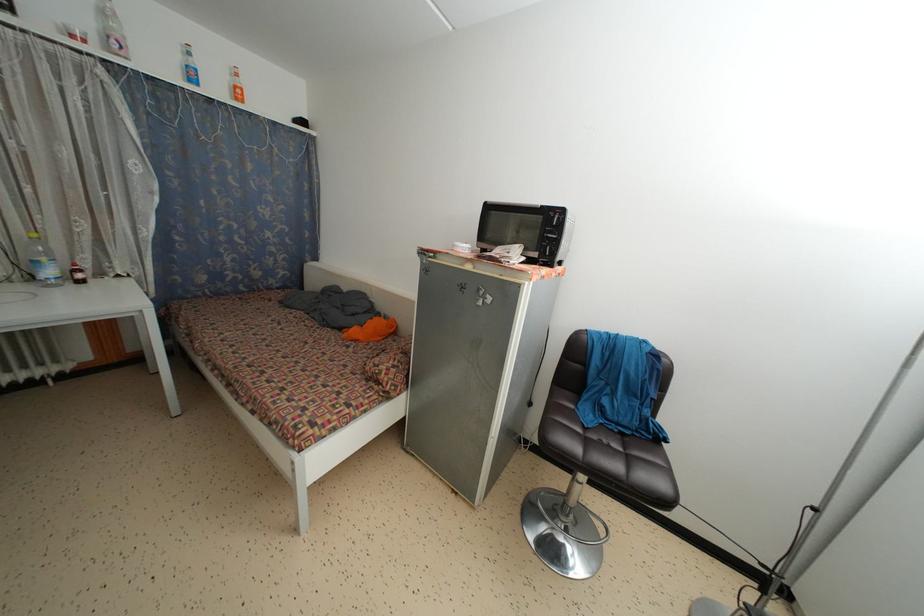
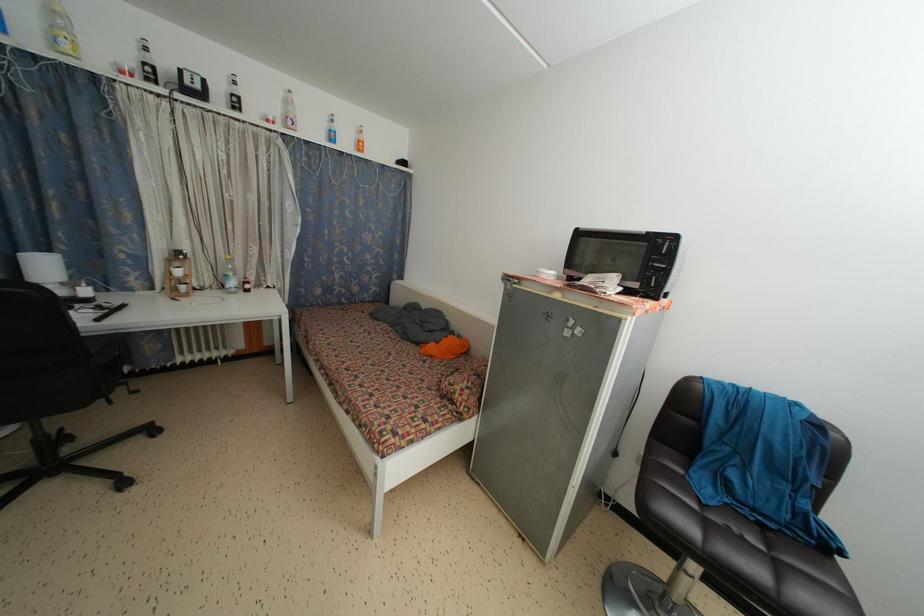
Locate, in the second image, the point that corresponds to the point at 310,349 in the first image.

(394, 360)